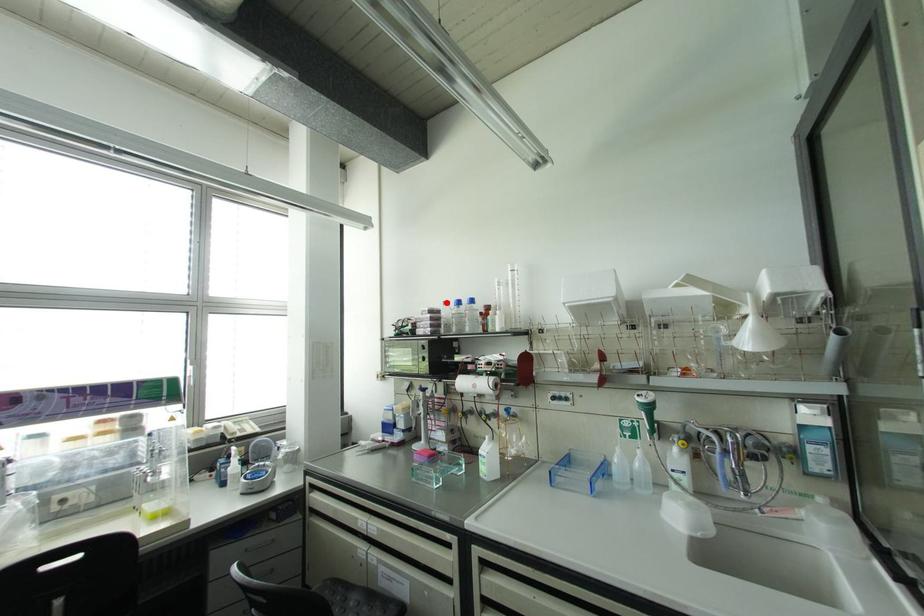
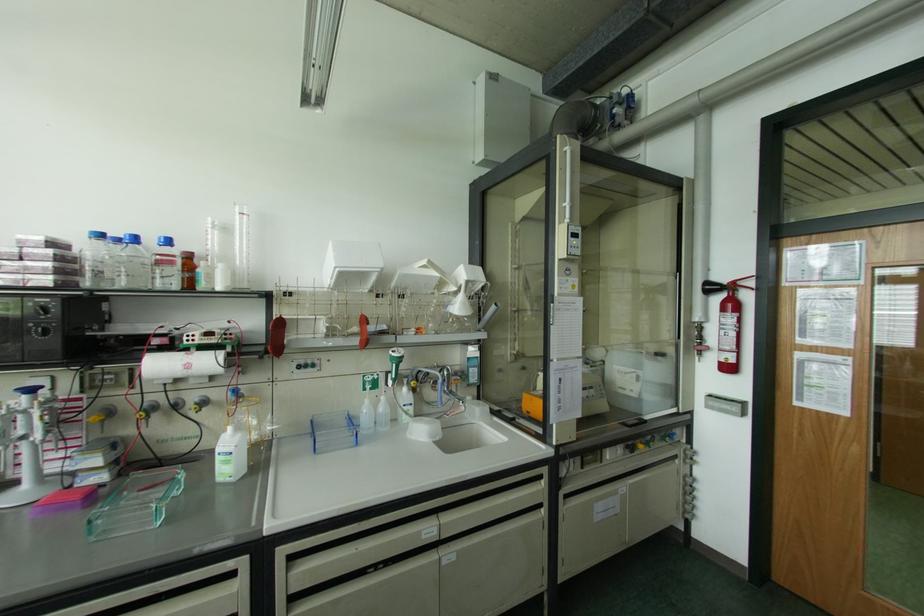
In the second image, find the point that corresponds to the highlighted location in the first image.

(101, 236)